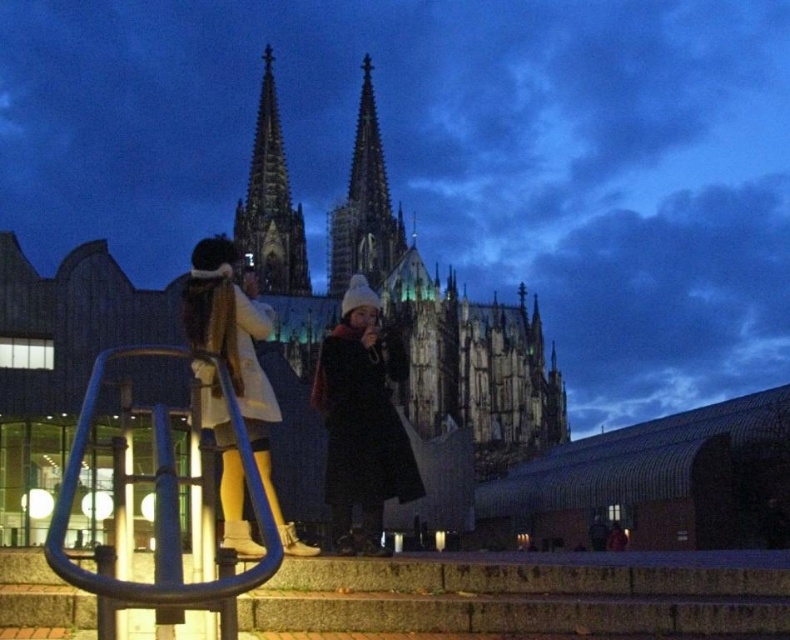
You are standing in front of the cathedral and want to take a photo of the dark gray stone tower at center and the dark brown leather coat at center. If you want the tower to appear to the left of the coat in the photo, should you position yourself to the left or right of the two objects?

You should position yourself to the right of the dark gray stone tower at center and dark brown leather coat at center. Since the dark gray stone tower at center is actually to the left of the dark brown leather coat at center, positioning yourself to the right will maintain their left to right order in the photo.

You are a photographer trying to capture both the dark gray stone tower at center and the dark brown leather coat at center in a single frame. Based on their sizes, which object would appear larger in your photo?

The dark gray stone tower at center would appear larger in the photo because it is wider than the dark brown leather coat at center.